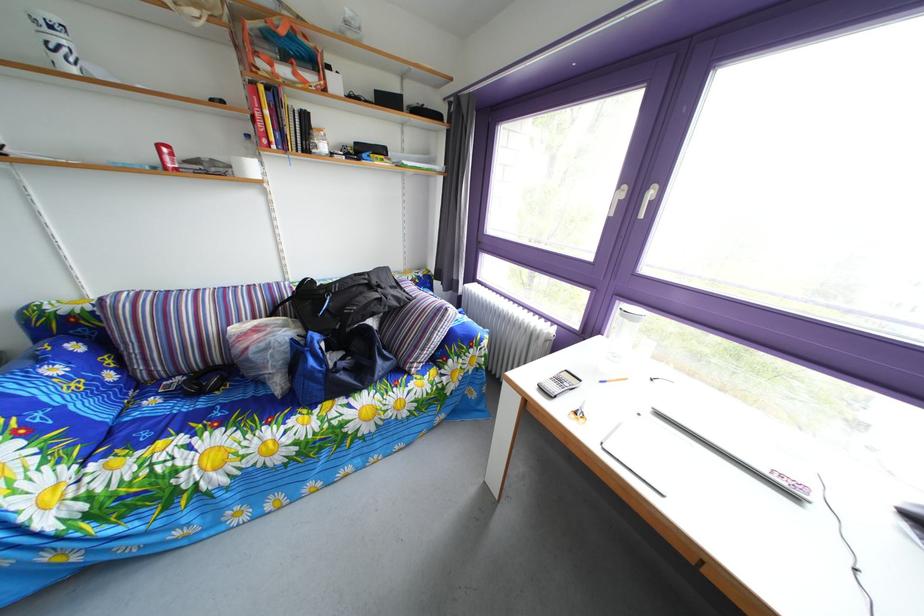
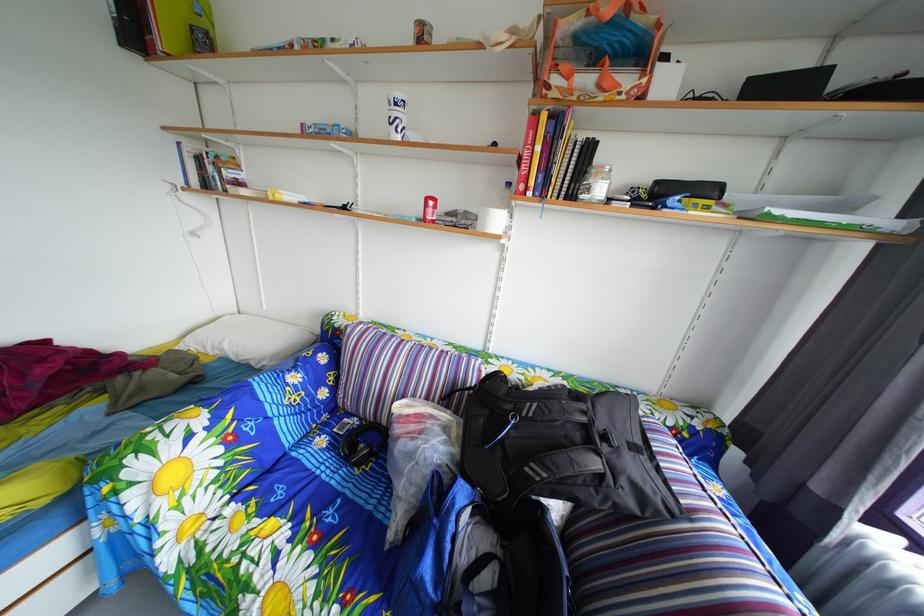
In the second image, find the point that corresponds to point (57, 38) in the first image.

(404, 116)